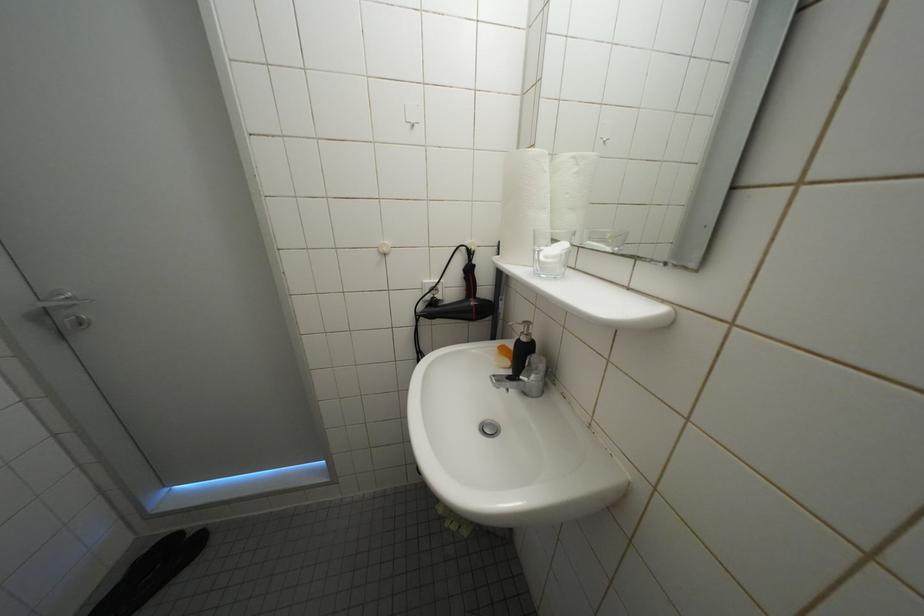
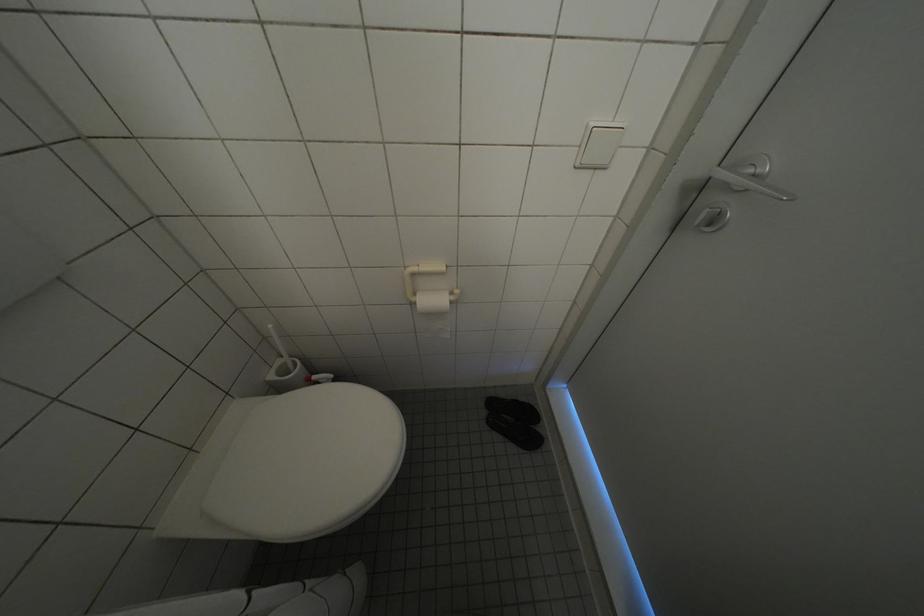
Based on the continuous images, in which direction is the camera rotating?

The camera's rotation is toward left-down.